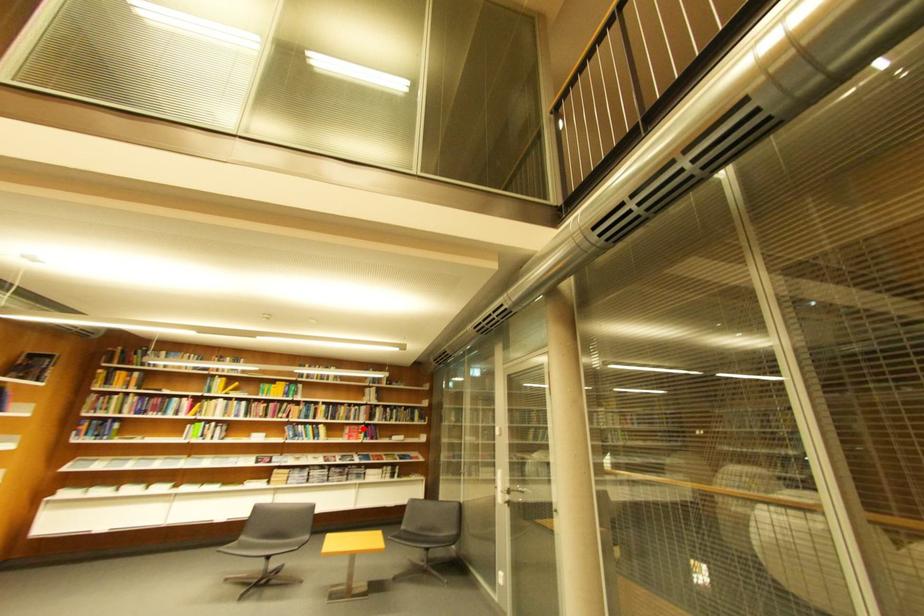
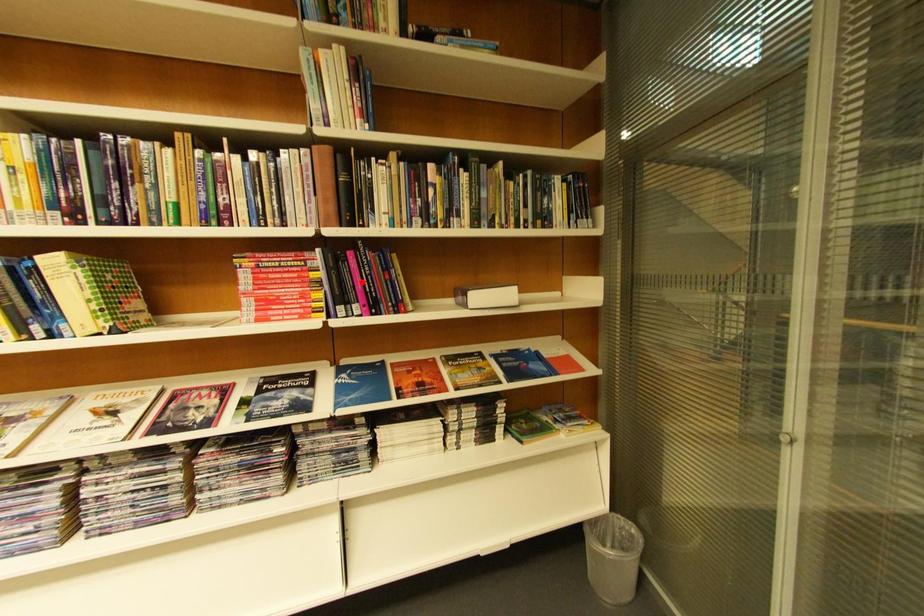
I am providing you with two images of the same scene from different viewpoints. A red point is marked on the first image and another point is marked on the second image. Do the highlighted points in image1 and image2 indicate the same real-world spot?

No